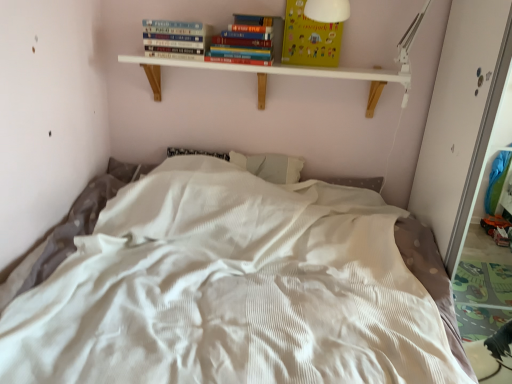
Locate an element on the screen. The height and width of the screenshot is (384, 512). vacant area that is in front of yellow paper at upper center is located at coordinates (311, 70).